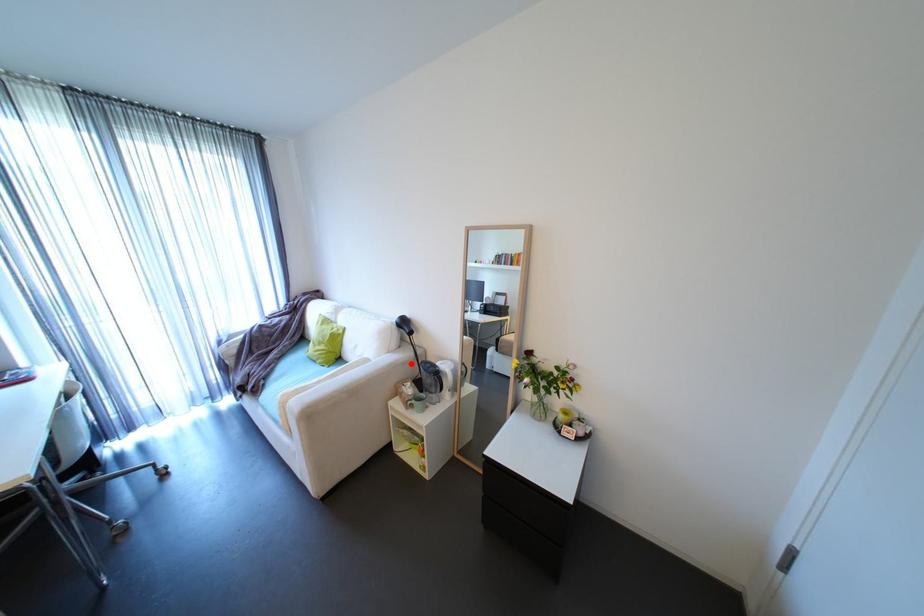
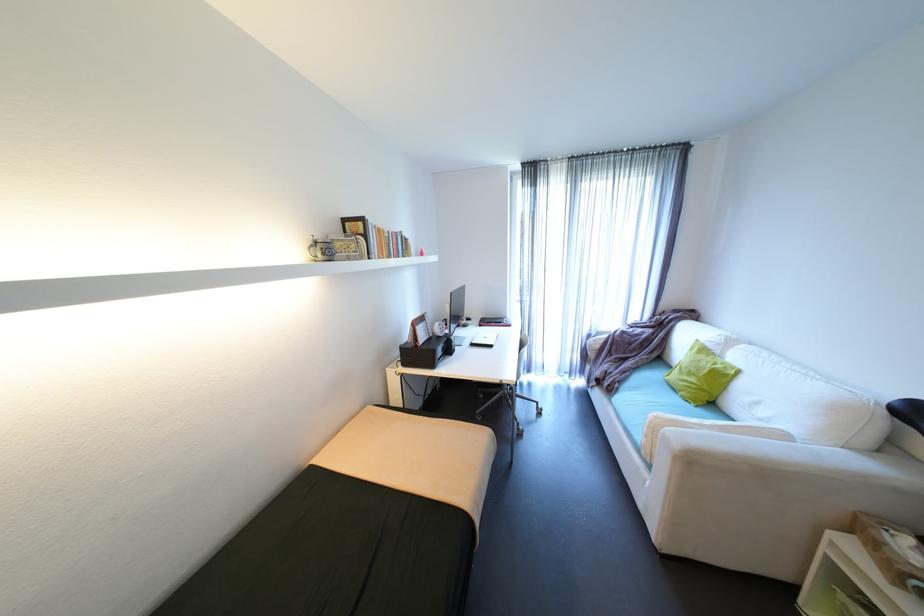
Where in the second image is the point corresponding to the highlighted location from the first image?

(907, 493)